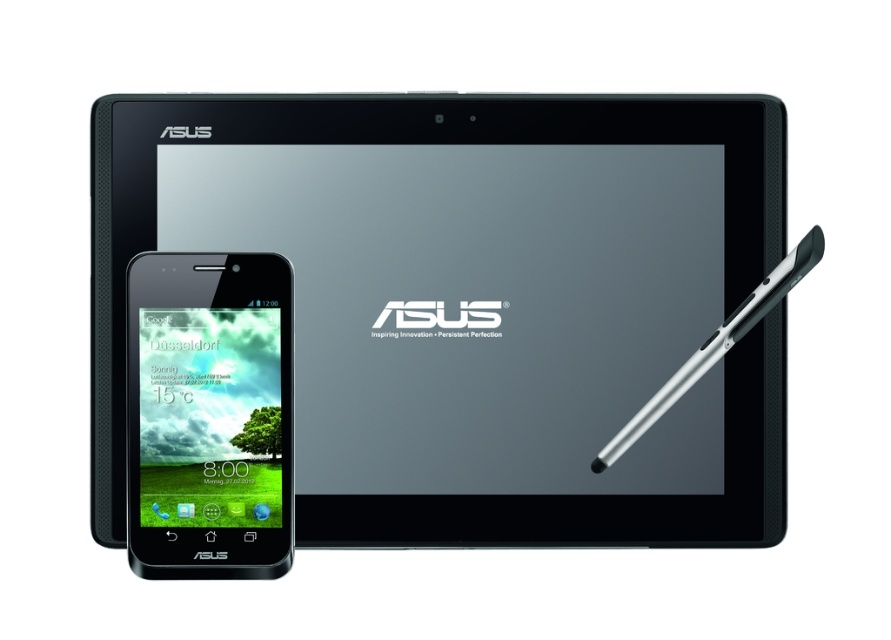
Does black matte tablet at upper center appear under silver metallic stylus at right?

Incorrect, black matte tablet at upper center is not positioned below silver metallic stylus at right.

Between black matte tablet at upper center and silver metallic stylus at right, which one is positioned lower?

silver metallic stylus at right is below.

Does point (358, 412) come behind point (652, 403)?

Yes, point (358, 412) is behind point (652, 403).

Where is `black matte tablet at upper center`? The width and height of the screenshot is (891, 640). black matte tablet at upper center is located at coordinates (477, 300).

Who is positioned more to the left, black matte smartphone at lower left or silver metallic stylus at right?

Positioned to the left is black matte smartphone at lower left.

Is point (279, 504) positioned after point (734, 324)?

No.

The width and height of the screenshot is (891, 640). I want to click on black matte smartphone at lower left, so click(209, 413).

Which of these two, black matte tablet at upper center or black matte smartphone at lower left, stands shorter?

Standing shorter between the two is black matte smartphone at lower left.

Which is behind, point (769, 524) or point (222, 444)?

Positioned behind is point (769, 524).

I want to click on black matte tablet at upper center, so click(477, 300).